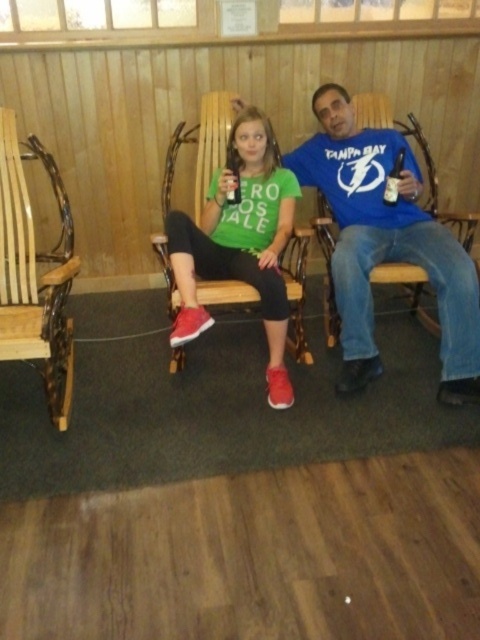
Can you confirm if matte green t-shirt at center is taller than clear plastic bottle at right?

Yes.

At what (x,y) coordinates should I click in order to perform the action: click on matte green t-shirt at center. Please return your answer as a coordinate pair (x, y). The height and width of the screenshot is (640, 480). Looking at the image, I should click on (240, 241).

Does point (276, 346) lie behind point (389, 179)?

No.

Where is `matte green t-shirt at center`? The width and height of the screenshot is (480, 640). matte green t-shirt at center is located at coordinates (240, 241).

Is wooden chair at left closer to camera compared to clear plastic bottle at right?

Yes, it is in front of clear plastic bottle at right.

Who is higher up, wooden chair at left or clear plastic bottle at right?

clear plastic bottle at right

Identify the location of wooden chair at left. (35, 273).

Identify the location of wooden chair at left. This screenshot has width=480, height=640. (35, 273).

Between point (388, 205) and point (391, 182), which one is positioned in front?

Point (391, 182) is more forward.

Is blue cotton shirt at center thinner than clear plastic bottle at right?

No.

Who is more forward, (336, 113) or (395, 173)?

Point (395, 173)

Locate an element on the screen. The height and width of the screenshot is (640, 480). blue cotton shirt at center is located at coordinates (385, 244).